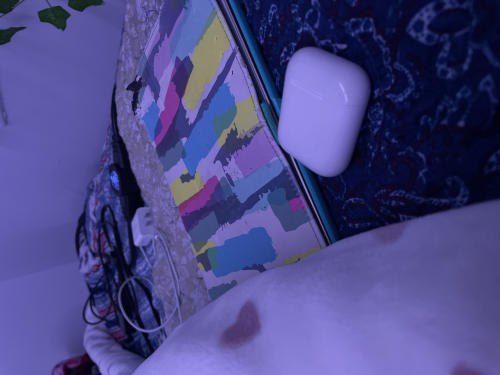
Find the location of `white charger`. white charger is located at coordinates (136, 228).